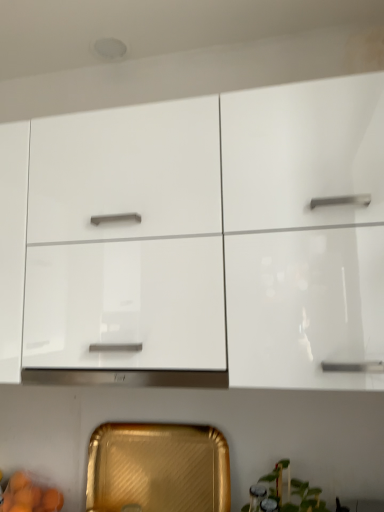
Question: Would you say white glossy cabinet at upper center, which ranks as the 1th cabinetry in top-to-bottom order, is to the left or to the right of gold textured tray at lower center, marked as the second cabinetry in a top-to-bottom arrangement, in the picture?

Choices:
 (A) right
 (B) left

Answer: (A)

Question: Considering their positions, is white glossy cabinet at upper center, which ranks as the 1th cabinetry in top-to-bottom order, located in front of or behind gold textured tray at lower center, marked as the second cabinetry in a top-to-bottom arrangement?

Choices:
 (A) front
 (B) behind

Answer: (A)

Question: Considering the real-world distances, which object is closest to the green glossy plant at lower right?

Choices:
 (A) gold textured tray at lower center, marked as the second cabinetry in a top-to-bottom arrangement
 (B) white glossy cabinet at upper center, which ranks as the 1th cabinetry in top-to-bottom order

Answer: (A)

Question: Which is farther from the white glossy cabinet at upper center, placed as the 2th cabinetry when sorted from bottom to top?

Choices:
 (A) green glossy plant at lower right
 (B) gold textured tray at lower center, which is the first cabinetry in bottom-to-top order

Answer: (A)